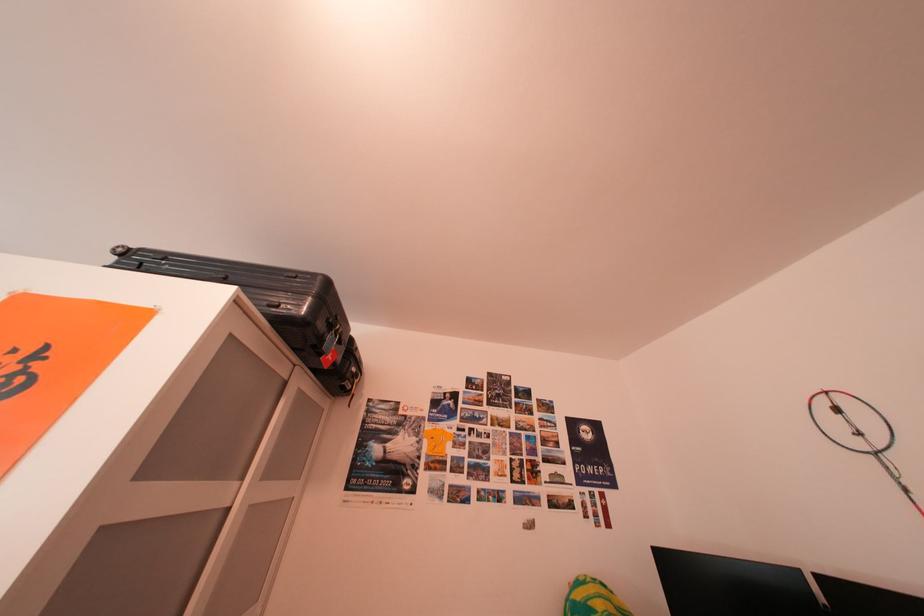
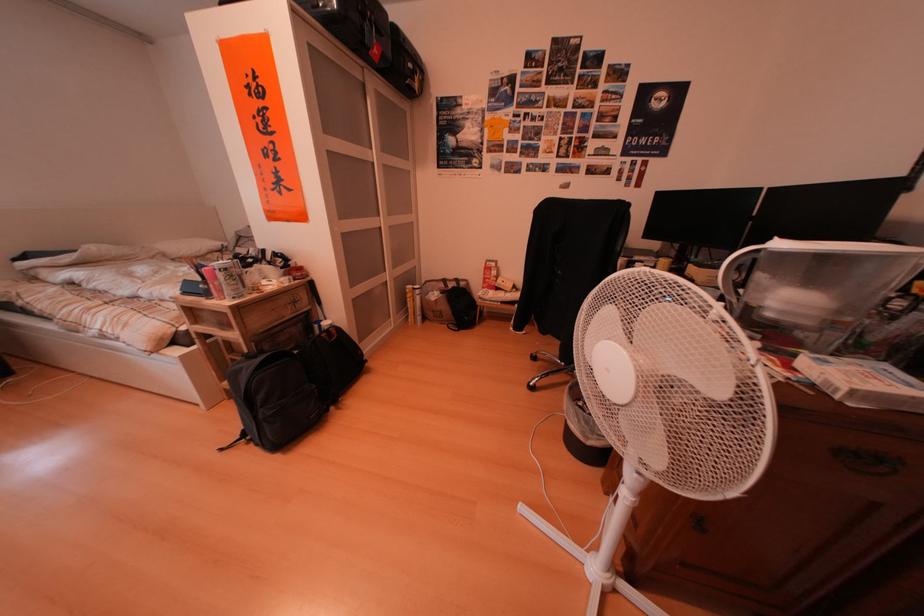
How did the camera likely rotate?

The camera's rotation is toward left-down.